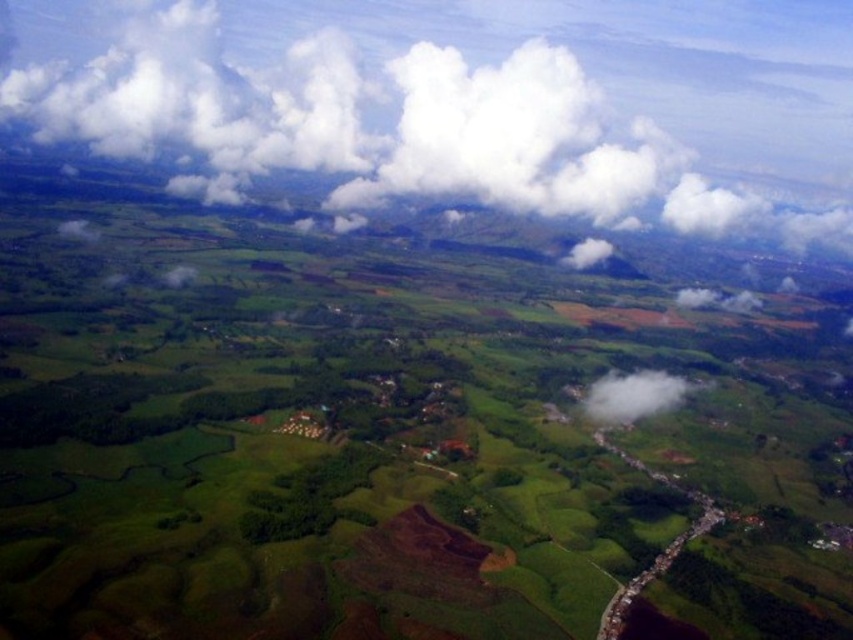
Does white fluffy cloud at upper center lie in front of white fluffy cloud at center?

No, white fluffy cloud at upper center is further to the viewer.

Is white fluffy cloud at upper center to the left of white fluffy cloud at center from the viewer's perspective?

Yes, white fluffy cloud at upper center is to the left of white fluffy cloud at center.

Which is behind, point (527, 131) or point (631, 384)?

Point (527, 131)

Where is `white fluffy cloud at upper center`? This screenshot has height=640, width=853. white fluffy cloud at upper center is located at coordinates (367, 131).

Is point (560, 456) in front of point (137, 132)?

Yes, point (560, 456) is in front of point (137, 132).

Does green grassy field at center appear under white fluffy cloud at upper center?

Yes, green grassy field at center is below white fluffy cloud at upper center.

Who is more forward, (119, 358) or (416, 97)?

Positioned in front is point (119, 358).

Locate an element on the screen. Image resolution: width=853 pixels, height=640 pixels. green grassy field at center is located at coordinates (389, 438).

Which is above, green grassy field at center or white fluffy cloud at center?

green grassy field at center is above.

Which is below, green grassy field at center or white fluffy cloud at center?

white fluffy cloud at center is lower down.

What are the coordinates of `green grassy field at center` in the screenshot? It's located at (389, 438).

Identify the location of green grassy field at center. This screenshot has height=640, width=853. (389, 438).